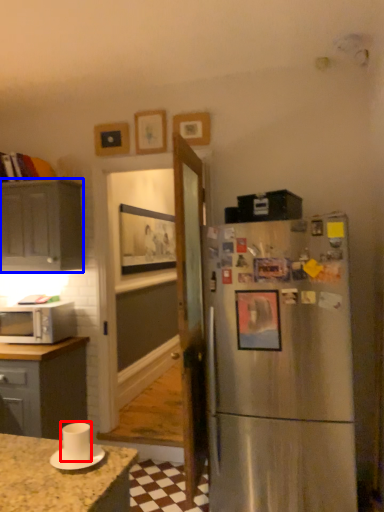
Question: Which object is closer to the camera taking this photo, appliance (highlighted by a red box) or cabinetry (highlighted by a blue box)?

Choices:
 (A) appliance
 (B) cabinetry

Answer: (A)